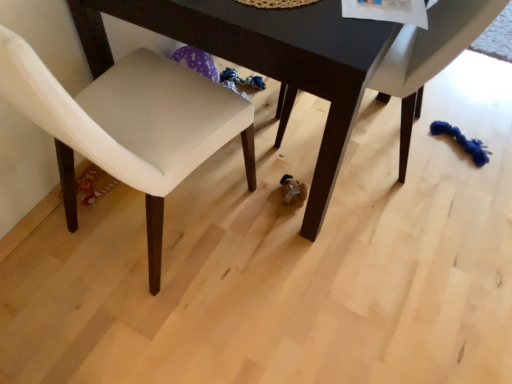
Locate an element on the screen. This screenshot has width=512, height=384. vacant space in between white leather chair at lower left, the 2th chair in the right-to-left sequence, and dark wood table at center is located at coordinates (215, 247).